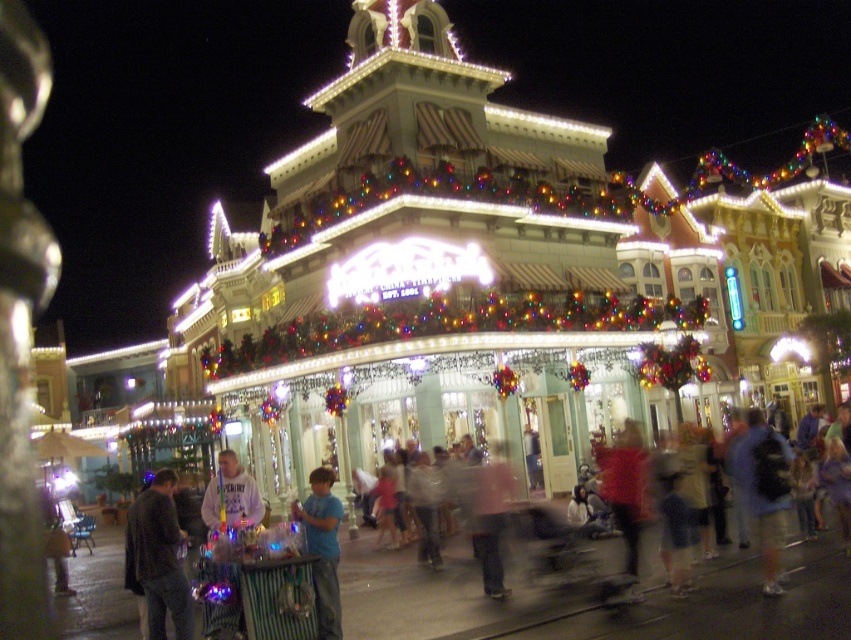
Is point (164, 499) more distant than point (304, 520)?

No, it is not.

Looking at this image, does dark gray sweater at lower left appear on the right side of blue cotton shirt at center?

In fact, dark gray sweater at lower left is to the left of blue cotton shirt at center.

Who is more forward, (x=143, y=490) or (x=326, y=492)?

Point (x=326, y=492) is more forward.

The width and height of the screenshot is (851, 640). Identify the location of dark gray sweater at lower left. (158, 557).

Who is taller, dark gray sweater at lower left or pink fabric at center?

Standing taller between the two is dark gray sweater at lower left.

Between point (153, 548) and point (492, 513), which one is positioned behind?

The point (492, 513) is more distant.

Is point (158, 637) positioned before point (487, 486)?

Yes.

At what (x,y) coordinates should I click in order to perform the action: click on dark gray sweater at lower left. Please return your answer as a coordinate pair (x, y). This screenshot has width=851, height=640. Looking at the image, I should click on (158, 557).

Does dark gray sweater at lower left have a larger size compared to blue backpack at lower right?

Yes.

Who is positioned more to the right, dark gray sweater at lower left or blue backpack at lower right?

From the viewer's perspective, blue backpack at lower right appears more on the right side.

The width and height of the screenshot is (851, 640). What do you see at coordinates (158, 557) in the screenshot?
I see `dark gray sweater at lower left` at bounding box center [158, 557].

Where is `dark gray sweater at lower left`? This screenshot has height=640, width=851. dark gray sweater at lower left is located at coordinates (158, 557).